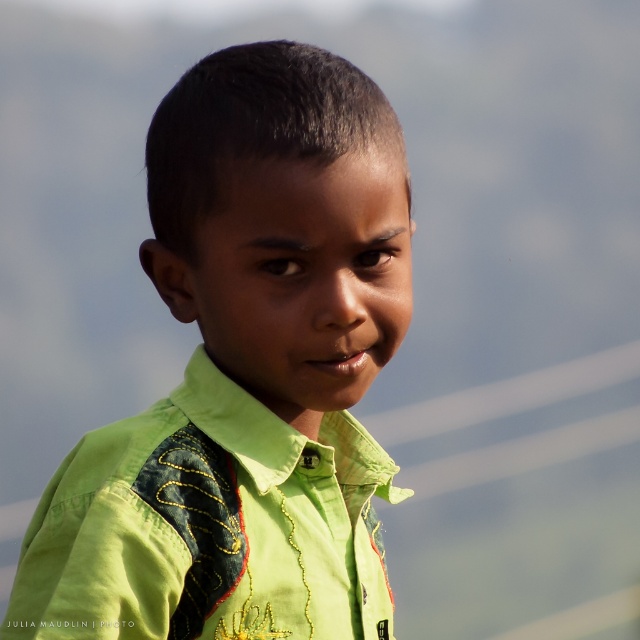
Question: Which of the following is the closest to the observer?

Choices:
 (A) (244, 324)
 (B) (141, 481)

Answer: (B)

Question: Is green fabric shirt at center above green embroidered shirt at center?

Choices:
 (A) no
 (B) yes

Answer: (B)

Question: Can you confirm if green fabric shirt at center is positioned above green embroidered shirt at center?

Choices:
 (A) no
 (B) yes

Answer: (B)

Question: Which point appears farthest from the camera in this image?

Choices:
 (A) (212, 474)
 (B) (228, 390)

Answer: (B)

Question: Considering the relative positions of green fabric shirt at center and green embroidered shirt at center in the image provided, where is green fabric shirt at center located with respect to green embroidered shirt at center?

Choices:
 (A) above
 (B) below

Answer: (A)